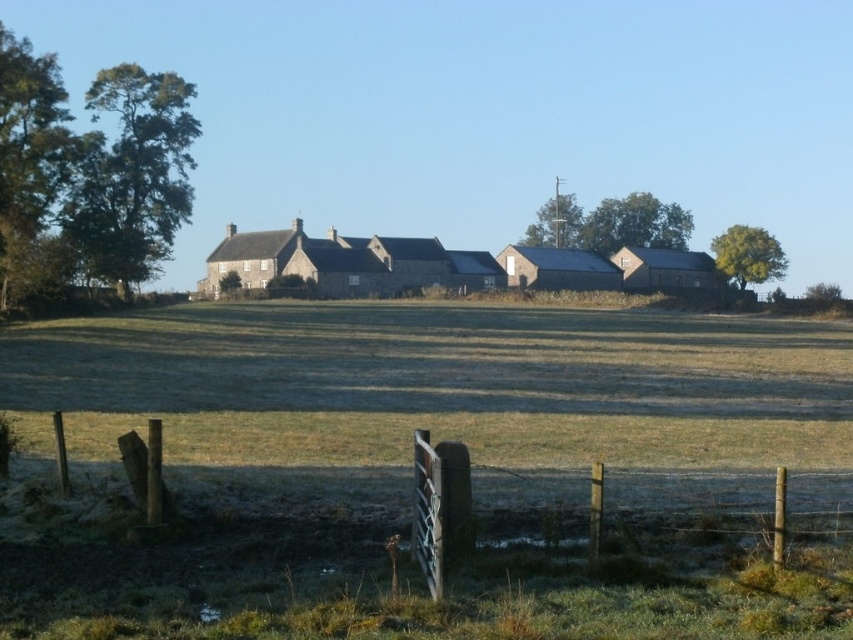
Question: Does wooden gate at center have a larger size compared to smooth gray barn at center?

Choices:
 (A) no
 (B) yes

Answer: (A)

Question: Estimate the real-world distances between objects in this image. Which object is closer to the wooden gate at center?

Choices:
 (A) smooth gray barn at center
 (B) stone barn at center
 (C) wooden gate at lower center

Answer: (C)

Question: Which is farther from the wooden gate at center?

Choices:
 (A) wooden gate at lower center
 (B) smooth gray barn at center
 (C) brown wooden barn at center-right

Answer: (B)

Question: Which object appears closest to the camera in this image?

Choices:
 (A) stone barn at center
 (B) smooth gray barn at center
 (C) brown wooden barn at center-right
 (D) wooden gate at center

Answer: (D)

Question: Is wooden gate at lower center in front of smooth gray barn at center?

Choices:
 (A) no
 (B) yes

Answer: (B)

Question: Does wooden gate at lower center appear on the right side of wooden gate at center?

Choices:
 (A) yes
 (B) no

Answer: (B)